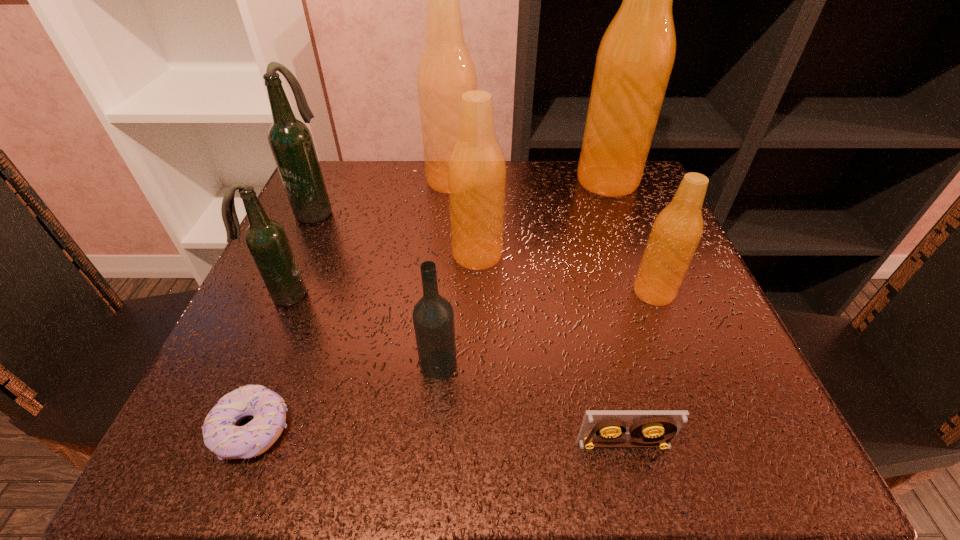
At what (x,y) coordinates should I click in order to perform the action: click on the third nearest object. Please return your answer as a coordinate pair (x, y). Image resolution: width=960 pixels, height=540 pixels. Looking at the image, I should click on (433, 317).

The height and width of the screenshot is (540, 960). I want to click on the eighth tallest object, so click(653, 428).

The image size is (960, 540). What are the coordinates of `brown videotape` in the screenshot? It's located at (653, 428).

You are a GUI agent. You are given a task and a screenshot of the screen. Output one action in this format:
    pyautogui.click(x=<x>, y=<y>)
    Task: Click on the doughnut
    This screenshot has width=960, height=540.
    Given the screenshot: What is the action you would take?
    pyautogui.click(x=222, y=435)

This screenshot has width=960, height=540. What are the coordinates of `brown doughnut` in the screenshot? It's located at (222, 435).

The width and height of the screenshot is (960, 540). Identify the location of free location located on the left of the biggest tan beer bottle. (516, 181).

I want to click on free space located on the front of the third smallest tan beer bottle, so click(439, 340).

This screenshot has height=540, width=960. Find the location of `free space located 0.080m on the front of the third farthest tan beer bottle`. free space located 0.080m on the front of the third farthest tan beer bottle is located at coordinates 477,305.

The width and height of the screenshot is (960, 540). I want to click on vacant space situated on the right of the farther dark beer bottle, so click(499, 211).

This screenshot has width=960, height=540. I want to click on vacant position located 0.090m on the left of the smallest tan beer bottle, so click(x=581, y=292).